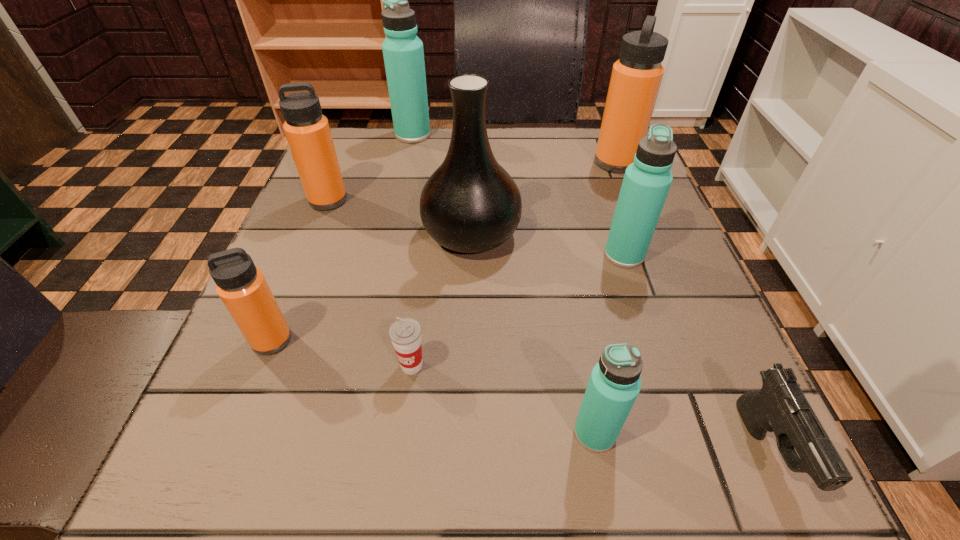
Choose which orange thermos bottle is the second nearest neighbor to the second nearest thermos bottle. Please provide its 2D coordinates. Your answer should be formatted as a tuple, i.e. [(x, y)], where the tuple contains the x and y coordinates of a point satisfying the conditions above.

[(636, 77)]

I want to click on orange thermos bottle that is the second closest one to the black pistol, so click(x=243, y=289).

At what (x,y) coordinates should I click in order to perform the action: click on blank space that satisfies the following two spatial constraints: 1. on the back side of the biggest orange thermos bottle; 2. on the right side of the smallest orange thermos bottle. Please return your answer as a coordinate pair (x, y). The height and width of the screenshot is (540, 960). Looking at the image, I should click on (343, 163).